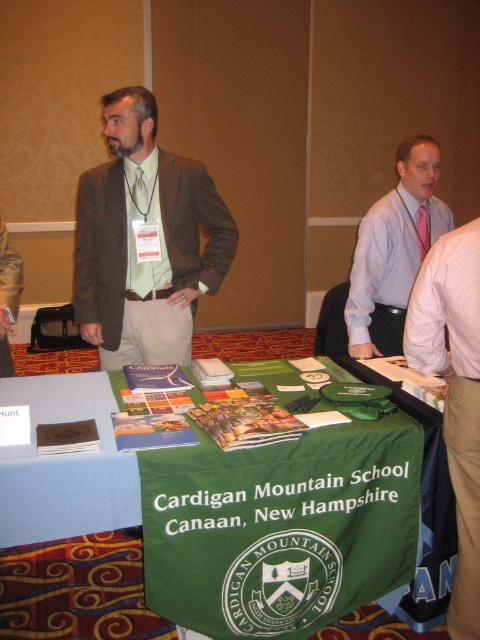
Question: Is brown wool suit at center further to the viewer compared to green fabric table at center?

Choices:
 (A) yes
 (B) no

Answer: (A)

Question: Which object is closer to the camera taking this photo?

Choices:
 (A) green fabric table at center
 (B) pink striped shirt at right
 (C) brown wool suit at center

Answer: (B)

Question: Among these objects, which one is farthest from the camera?

Choices:
 (A) green fabric table at center
 (B) brown wool suit at center

Answer: (B)

Question: Does brown wool suit at center appear over green fabric table at center?

Choices:
 (A) yes
 (B) no

Answer: (A)

Question: Among these points, which one is nearest to the camera?

Choices:
 (A) (471, 636)
 (B) (131, 224)
 (C) (363, 218)

Answer: (A)

Question: Can you confirm if brown wool suit at center is bigger than pink striped shirt at right?

Choices:
 (A) no
 (B) yes

Answer: (B)